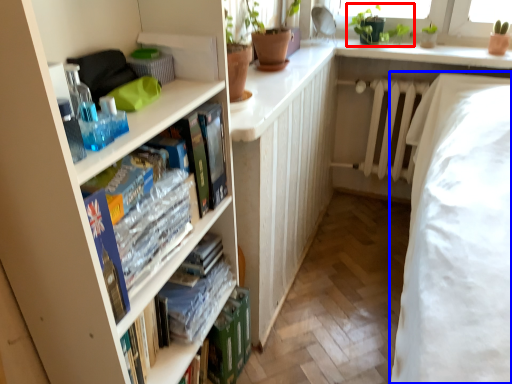
Question: Which object is further to the camera taking this photo, plant (highlighted by a red box) or bed (highlighted by a blue box)?

Choices:
 (A) plant
 (B) bed

Answer: (A)